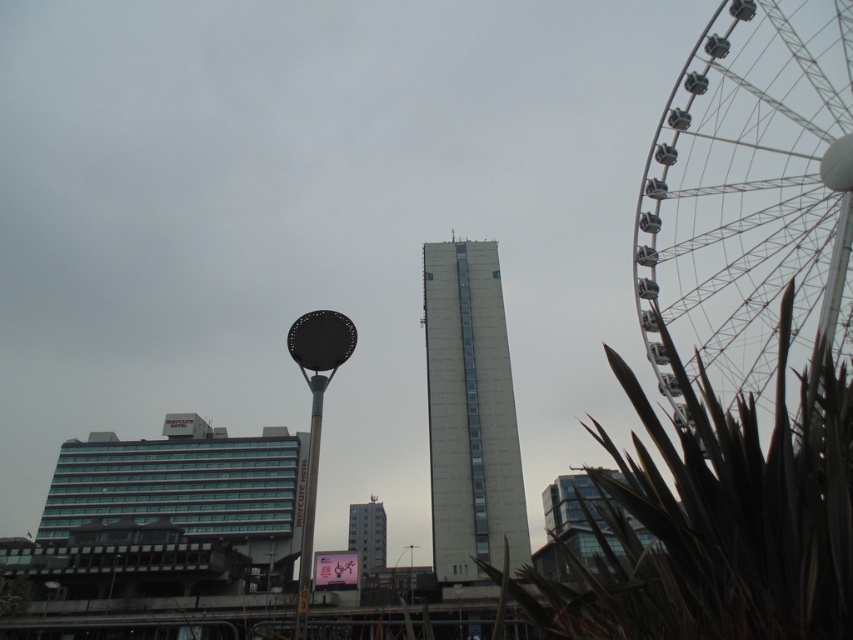
Question: Estimate the real-world distances between objects in this image. Which object is closer to the white glass building at center?

Choices:
 (A) white smooth building at center
 (B) white glossy pole at center

Answer: (B)

Question: Which point is farther to the camera?

Choices:
 (A) (454, 355)
 (B) (676, 250)
 (C) (355, 532)

Answer: (C)

Question: Can you confirm if white smooth building at center is thinner than white glass building at center?

Choices:
 (A) yes
 (B) no

Answer: (B)

Question: Among these objects, which one is farthest from the camera?

Choices:
 (A) metallic gray ferris wheel at right
 (B) white smooth building at center
 (C) white glass building at center

Answer: (C)

Question: Is metallic gray ferris wheel at right positioned at the back of white glossy pole at center?

Choices:
 (A) yes
 (B) no

Answer: (B)

Question: Is metallic gray ferris wheel at right above white glass building at center?

Choices:
 (A) yes
 (B) no

Answer: (A)